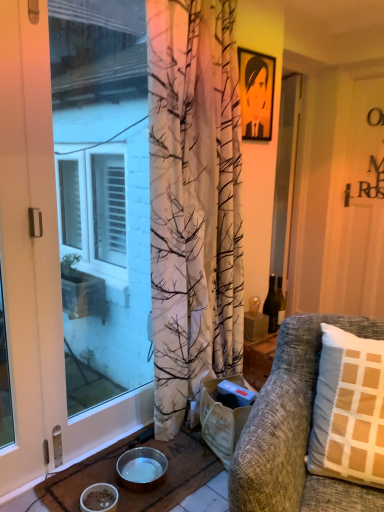
From the picture: What is the approximate width of matte black picture frame at upper center?

matte black picture frame at upper center is 1.01 inches in width.

Image resolution: width=384 pixels, height=512 pixels. Identify the location of white matte bowl at lower left, which appears as the 1th bowl when viewed from the front. (99, 498).

Locate an element on the screen. transparent glass screen door at center, placed as the 2th screen door when sorted from left to right is located at coordinates pos(285,177).

Describe the element at coordinates (285, 177) in the screenshot. The width and height of the screenshot is (384, 512). I see `transparent glass screen door at center, which is the 1th screen door from back to front` at that location.

What do you see at coordinates (271, 306) in the screenshot?
I see `translucent glass bottle at center right` at bounding box center [271, 306].

Identify the location of translucent glass bottle at center right. (271, 306).

What is the approximate width of textured gray couch at right?

It is 81.70 centimeters.

The height and width of the screenshot is (512, 384). Describe the element at coordinates (30, 247) in the screenshot. I see `white glossy screen door at left, the 1th screen door viewed from the front` at that location.

I want to click on metallic silver bowl at lower center, the first bowl from the back, so click(x=141, y=468).

Does white matte bowl at lower left, which appears as the 1th bowl when viewed from the front, have a lesser height compared to matte white door at left?

Yes.

Considering the positions of points (104, 505) and (146, 154), is point (104, 505) farther from camera compared to point (146, 154)?

No, it is in front of (146, 154).

Is white matte bowl at lower left, which ranks as the 2th bowl in back-to-front order, not inside matte white door at left?

Yes.

Is point (266, 75) farther from viewer compared to point (269, 279)?

That is False.

Looking at the image, does matte black picture frame at upper center seem bigger or smaller compared to translucent glass bottle at center right?

Considering their sizes, matte black picture frame at upper center takes up more space than translucent glass bottle at center right.

Considering the relative sizes of matte black picture frame at upper center and translucent glass bottle at center right in the image provided, is matte black picture frame at upper center thinner than translucent glass bottle at center right?

Yes, matte black picture frame at upper center is thinner than translucent glass bottle at center right.

Considering the relative sizes of white glossy screen door at left, marked as the 1th screen door in a left-to-right arrangement, and brown woven mat at lower left in the image provided, is white glossy screen door at left, marked as the 1th screen door in a left-to-right arrangement, bigger than brown woven mat at lower left?

Yes.

Is white glossy screen door at left, marked as the 1th screen door in a left-to-right arrangement, oriented towards brown woven mat at lower left?

No, white glossy screen door at left, marked as the 1th screen door in a left-to-right arrangement, is not facing towards brown woven mat at lower left.

Considering the relative sizes of white glossy screen door at left, marked as the 1th screen door in a left-to-right arrangement, and brown woven mat at lower left in the image provided, is white glossy screen door at left, marked as the 1th screen door in a left-to-right arrangement, thinner than brown woven mat at lower left?

Yes.

Does white glossy screen door at left, acting as the 2th screen door starting from the back, have a greater height compared to brown woven mat at lower left?

Yes.

Is translucent glass bottle at center right positioned far away from white glossy screen door at left, marked as the 1th screen door in a left-to-right arrangement?

That's right, there is a large distance between translucent glass bottle at center right and white glossy screen door at left, marked as the 1th screen door in a left-to-right arrangement.

Is translucent glass bottle at center right behind white glossy screen door at left, marked as the 1th screen door in a left-to-right arrangement?

Yes, translucent glass bottle at center right is behind white glossy screen door at left, marked as the 1th screen door in a left-to-right arrangement.

Considering the sizes of translucent glass bottle at center right and white glossy screen door at left, acting as the 2th screen door starting from the back, in the image, is translucent glass bottle at center right bigger or smaller than white glossy screen door at left, acting as the 2th screen door starting from the back,?

Considering their sizes, translucent glass bottle at center right takes up less space than white glossy screen door at left, acting as the 2th screen door starting from the back.

Would you say translucent glass bottle at center right is to the left or to the right of white glossy screen door at left, acting as the 2th screen door starting from the back, in the picture?

In the image, translucent glass bottle at center right appears on the right side of white glossy screen door at left, acting as the 2th screen door starting from the back.

What's the angular difference between textured gray couch at right and white matte bowl at lower left, which ranks as the 2th bowl in back-to-front order,'s facing directions?

68.4 degrees.

From the image's perspective, is textured gray couch at right positioned above or below white matte bowl at lower left, which ranks as the 2th bowl in back-to-front order?

textured gray couch at right is above white matte bowl at lower left, which ranks as the 2th bowl in back-to-front order.

From the picture: Who is smaller, textured gray couch at right or white matte bowl at lower left, which ranks as the 2th bowl in back-to-front order?

white matte bowl at lower left, which ranks as the 2th bowl in back-to-front order, is smaller.

Identify the location of studio couch in front of the white matte bowl at lower left, which appears as the 1th bowl when viewed from the front. pos(294,429).

Considering the sizes of white matte bowl at lower left, which ranks as the 2th bowl in back-to-front order, and white glossy screen door at left, acting as the 2th screen door starting from the back, in the image, is white matte bowl at lower left, which ranks as the 2th bowl in back-to-front order, taller or shorter than white glossy screen door at left, acting as the 2th screen door starting from the back,?

In the image, white matte bowl at lower left, which ranks as the 2th bowl in back-to-front order, appears to be shorter than white glossy screen door at left, acting as the 2th screen door starting from the back.

Is white matte bowl at lower left, which ranks as the 2th bowl in back-to-front order, outside of white glossy screen door at left, the 2th screen door when ordered from right to left?

That's correct, white matte bowl at lower left, which ranks as the 2th bowl in back-to-front order, is outside of white glossy screen door at left, the 2th screen door when ordered from right to left.

Considering the relative positions of white matte bowl at lower left, which appears as the 1th bowl when viewed from the front, and white glossy screen door at left, the 1th screen door viewed from the front, in the image provided, is white matte bowl at lower left, which appears as the 1th bowl when viewed from the front, behind white glossy screen door at left, the 1th screen door viewed from the front,?

Yes, the depth of white matte bowl at lower left, which appears as the 1th bowl when viewed from the front, is greater than that of white glossy screen door at left, the 1th screen door viewed from the front.

Which is behind, point (19, 7) or point (117, 231)?

The point (117, 231) is farther.

Is white glossy screen door at left, the 2th screen door when ordered from right to left, turned away from matte white door at left?

white glossy screen door at left, the 2th screen door when ordered from right to left, does not have its back to matte white door at left.

Considering the sizes of white glossy screen door at left, the 1th screen door viewed from the front, and matte white door at left in the image, is white glossy screen door at left, the 1th screen door viewed from the front, wider or thinner than matte white door at left?

In the image, white glossy screen door at left, the 1th screen door viewed from the front, appears to be wider than matte white door at left.

There is a white matte bowl at lower left, which appears as the 1th bowl when viewed from the front. At what (x,y) coordinates should I click in order to perform the action: click on door above it (from a real-world perspective). Please return your answer as a coordinate pair (x, y). Looking at the image, I should click on (73, 228).

Find the location of a particular element. bottle below the matte black picture frame at upper center (from the image's perspective) is located at coordinates (271, 306).

Based on their spatial positions, is textured gray couch at right or white matte bowl at lower left, which ranks as the 2th bowl in back-to-front order, closer to transparent glass screen door at center, placed as the 2th screen door when sorted from left to right?

Based on the image, textured gray couch at right appears to be nearer to transparent glass screen door at center, placed as the 2th screen door when sorted from left to right.

Looking at the image, which one is located further to brown woven mat at lower left, transparent glass screen door at center, placed as the 2th screen door when sorted from left to right, or white matte bowl at lower left, which appears as the 1th bowl when viewed from the front?

transparent glass screen door at center, placed as the 2th screen door when sorted from left to right, is further to brown woven mat at lower left.

From the image, which object appears to be farther from white glossy screen door at left, the 2th screen door when ordered from right to left, translucent glass bottle at center right or matte white door at left?

translucent glass bottle at center right is positioned further to the anchor white glossy screen door at left, the 2th screen door when ordered from right to left.

Which object lies further to the anchor point matte black picture frame at upper center, metallic silver bowl at lower center, the first bowl from the back, or brown woven mat at lower left?

Among the two, metallic silver bowl at lower center, the first bowl from the back, is located further to matte black picture frame at upper center.

In the scene shown: Looking at the image, which one is located closer to metallic silver bowl at lower center, which is counted as the 2th bowl, starting from the front, brown woven mat at lower left or matte white door at left?

Among the two, brown woven mat at lower left is located nearer to metallic silver bowl at lower center, which is counted as the 2th bowl, starting from the front.

Considering their positions, is brown woven mat at lower left positioned closer to matte black picture frame at upper center than white matte bowl at lower left, which ranks as the 2th bowl in back-to-front order?

brown woven mat at lower left lies closer to matte black picture frame at upper center than the other object.

From the image, which object appears to be farther from textured gray couch at right, translucent glass bottle at center right or metallic silver bowl at lower center, the first bowl from the back?

Among the two, translucent glass bottle at center right is located further to textured gray couch at right.

Looking at the image, which one is located closer to transparent glass screen door at center, which is the 1th screen door from back to front, white matte bowl at lower left, which ranks as the 2th bowl in back-to-front order, or metallic silver bowl at lower center, which is counted as the 2th bowl, starting from the front?

metallic silver bowl at lower center, which is counted as the 2th bowl, starting from the front.

Where is `doormat located between white matte bowl at lower left, which appears as the 1th bowl when viewed from the front, and textured gray couch at right in the left-right direction`? doormat located between white matte bowl at lower left, which appears as the 1th bowl when viewed from the front, and textured gray couch at right in the left-right direction is located at coordinates (136, 490).

Locate an element on the screen. studio couch that lies between matte white door at left and white matte bowl at lower left, which appears as the 1th bowl when viewed from the front, from top to bottom is located at coordinates (294, 429).

The height and width of the screenshot is (512, 384). Find the location of `bottle that lies between matte black picture frame at upper center and brown woven mat at lower left from top to bottom`. bottle that lies between matte black picture frame at upper center and brown woven mat at lower left from top to bottom is located at coordinates point(271,306).

At what (x,y) coordinates should I click in order to perform the action: click on screen door that lies between matte white door at left and metallic silver bowl at lower center, which is counted as the 2th bowl, starting from the front, from top to bottom. Please return your answer as a coordinate pair (x, y). The width and height of the screenshot is (384, 512). Looking at the image, I should click on [30, 247].